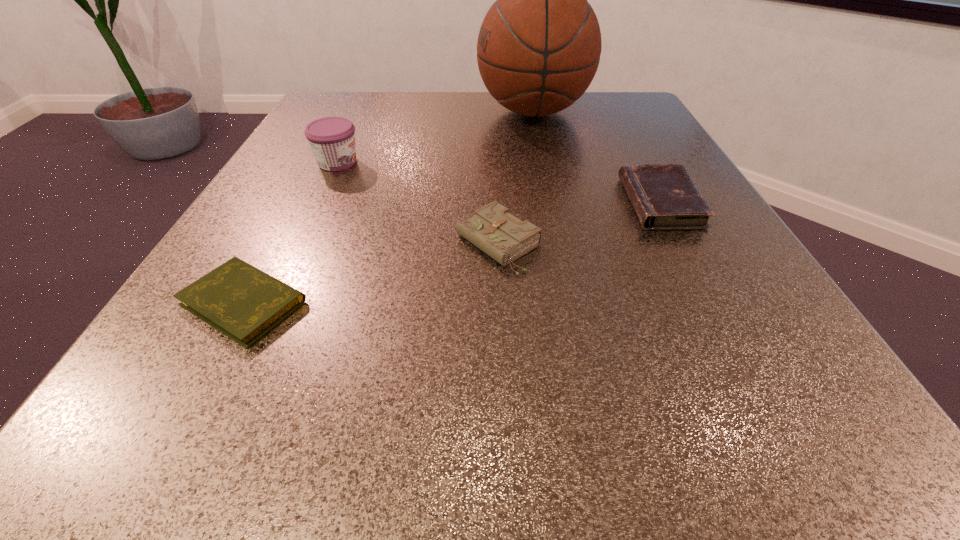
What are the coordinates of `the tallest object` in the screenshot? It's located at (539, 45).

Identify the location of basketball. The height and width of the screenshot is (540, 960). (539, 45).

At what (x,y) coordinates should I click in order to perform the action: click on jam. Please return your answer as a coordinate pair (x, y). Looking at the image, I should click on (332, 139).

Find the location of `the fourth shortest object`. the fourth shortest object is located at coordinates (332, 139).

Image resolution: width=960 pixels, height=540 pixels. Find the location of `the second diary from right to left`. the second diary from right to left is located at coordinates (492, 229).

Locate an element on the screen. The image size is (960, 540). the rightmost diary is located at coordinates tap(664, 196).

Where is `the shortest diary`? the shortest diary is located at coordinates (242, 302).

Where is `the shortest object`? This screenshot has width=960, height=540. the shortest object is located at coordinates tap(242, 302).

Identify the location of vacant space located 0.170m on the side with brand label of the basketball. (403, 112).

In order to click on free space located on the side with brand label of the basketball in this screenshot , I will do [x=446, y=112].